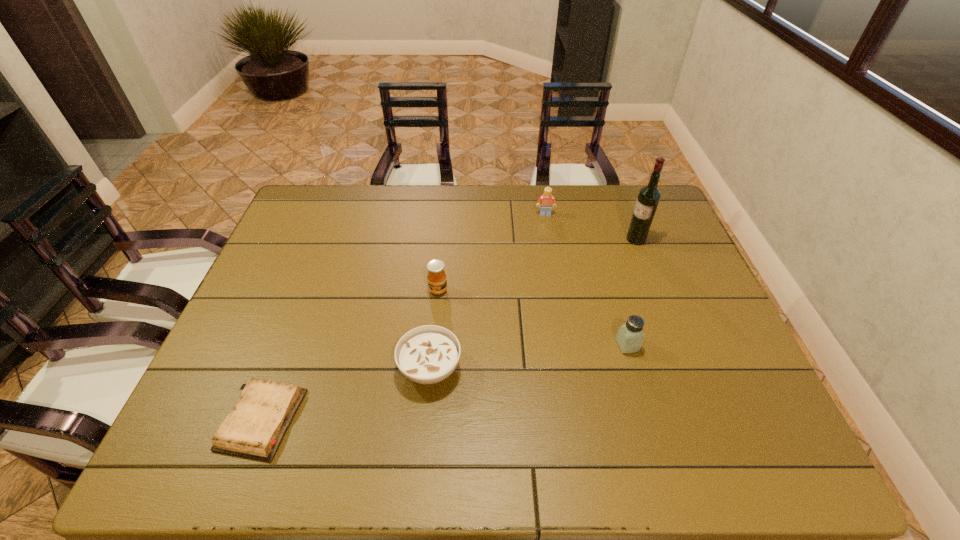
Where is `vacant space situated 0.280m on the front and back of the fifth nearest object`? The height and width of the screenshot is (540, 960). vacant space situated 0.280m on the front and back of the fifth nearest object is located at coordinates pos(538,239).

Locate an element on the screen. free space located 0.080m on the front and back of the fifth nearest object is located at coordinates (601, 239).

This screenshot has width=960, height=540. I want to click on free space located on the front-facing side of the farthest object, so click(561, 306).

Locate an element on the screen. free space located on the front-facing side of the honey is located at coordinates (435, 329).

Where is `free space located 0.170m on the left of the fifth object from left to right`? This screenshot has width=960, height=540. free space located 0.170m on the left of the fifth object from left to right is located at coordinates (549, 345).

At what (x,y) coordinates should I click in order to perform the action: click on vacant space located 0.300m on the right of the soup bowl. Please return your answer as a coordinate pair (x, y). Image resolution: width=960 pixels, height=540 pixels. Looking at the image, I should click on (586, 368).

I want to click on free point located 0.370m on the right of the diary, so click(467, 420).

Where is `object at the far edge`? object at the far edge is located at coordinates (547, 200).

The width and height of the screenshot is (960, 540). What are the coordinates of `object positioned at the near edge` in the screenshot? It's located at (254, 429).

In order to click on object located at the left edge in this screenshot , I will do `click(254, 429)`.